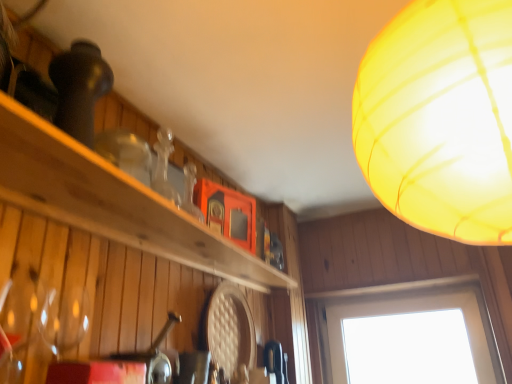
Question: Should I look upward or downward to see translucent yellow lampshade at upper right?

Choices:
 (A) down
 (B) up

Answer: (B)

Question: Can you confirm if wooden shelf at upper left is positioned to the left of transparent glass window at lower right?

Choices:
 (A) yes
 (B) no

Answer: (A)

Question: From a real-world perspective, does wooden shelf at upper left sit lower than transparent glass window at lower right?

Choices:
 (A) no
 (B) yes

Answer: (A)

Question: Is wooden shelf at upper left oriented towards transparent glass window at lower right?

Choices:
 (A) no
 (B) yes

Answer: (A)

Question: Is wooden shelf at upper left outside transparent glass window at lower right?

Choices:
 (A) yes
 (B) no

Answer: (A)

Question: Is wooden shelf at upper left far away from transparent glass window at lower right?

Choices:
 (A) yes
 (B) no

Answer: (A)

Question: Is wooden shelf at upper left bigger than transparent glass window at lower right?

Choices:
 (A) yes
 (B) no

Answer: (B)

Question: Is translucent yellow lampshade at upper right to the left of wooden shelf at upper left from the viewer's perspective?

Choices:
 (A) no
 (B) yes

Answer: (A)

Question: Is translucent yellow lampshade at upper right oriented towards wooden shelf at upper left?

Choices:
 (A) no
 (B) yes

Answer: (A)

Question: From the image's perspective, is translucent yellow lampshade at upper right on wooden shelf at upper left?

Choices:
 (A) yes
 (B) no

Answer: (A)

Question: Can you confirm if translucent yellow lampshade at upper right is wider than wooden shelf at upper left?

Choices:
 (A) no
 (B) yes

Answer: (B)

Question: Is wooden shelf at upper left completely or partially inside translucent yellow lampshade at upper right?

Choices:
 (A) yes
 (B) no

Answer: (B)

Question: Can you confirm if translucent yellow lampshade at upper right is thinner than wooden shelf at upper left?

Choices:
 (A) yes
 (B) no

Answer: (B)

Question: From the image's perspective, does translucent yellow lampshade at upper right appear lower than transparent glass window at lower right?

Choices:
 (A) yes
 (B) no

Answer: (B)